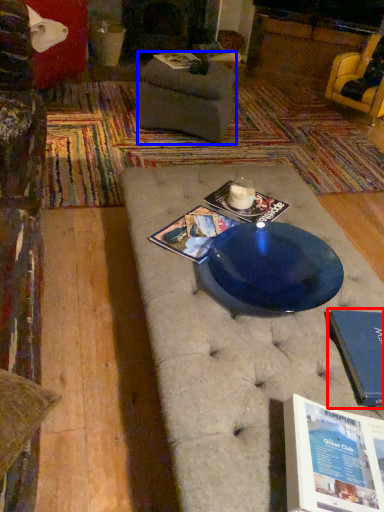
Question: Which of the following is the closest to the observer, paperback book (highlighted by a red box) or footrest (highlighted by a blue box)?

Choices:
 (A) paperback book
 (B) footrest

Answer: (A)